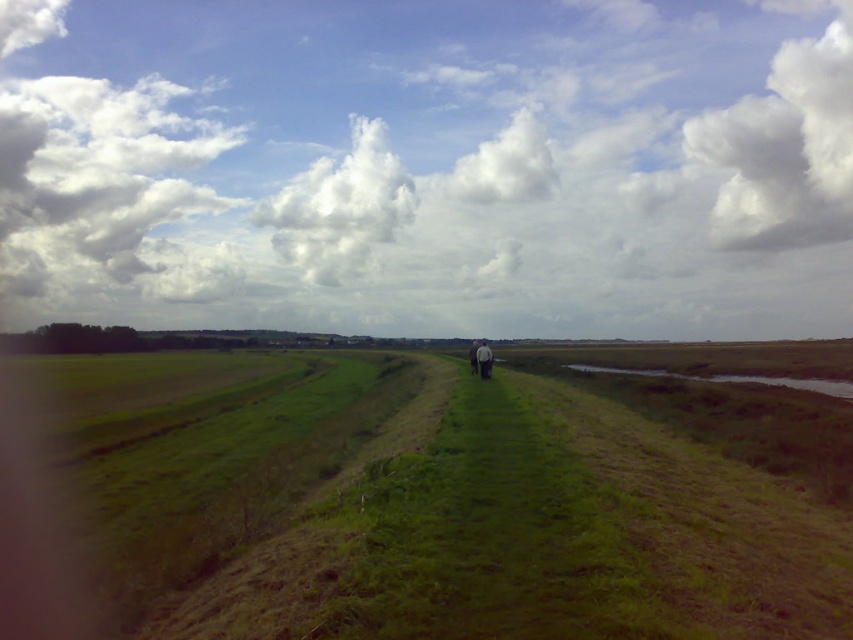
Can you confirm if green grassy path at center is smaller than white fabric couple at center?

No, green grassy path at center is not smaller than white fabric couple at center.

Who is higher up, green grassy path at center or white fabric couple at center?

white fabric couple at center

Is point (323, 582) positioned behind point (479, 352)?

No, it is not.

I want to click on green grassy path at center, so click(x=422, y=506).